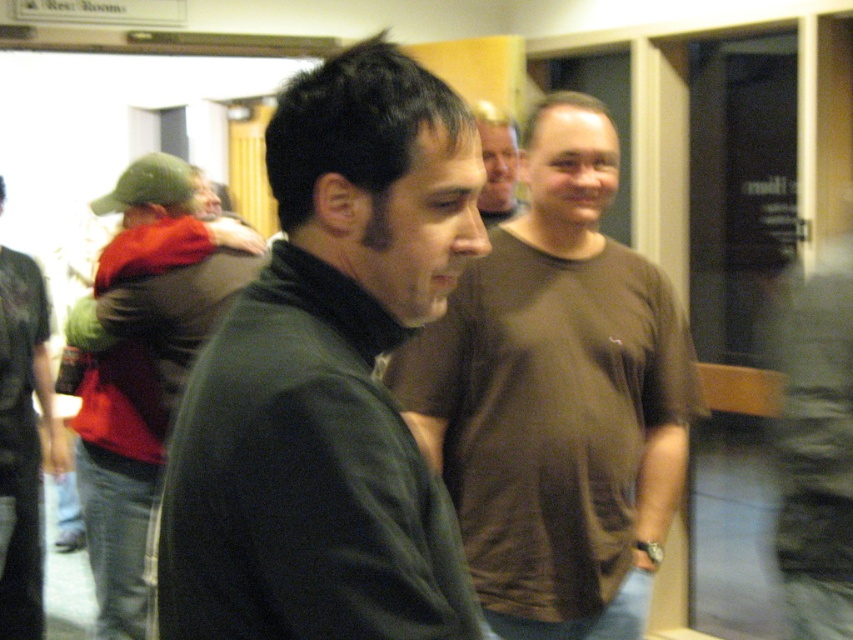
Question: Is brown cotton shirt at center positioned at the back of dark gray sweater at left?

Choices:
 (A) yes
 (B) no

Answer: (B)

Question: Does dark green sweater at center have a larger size compared to brown cotton shirt at center?

Choices:
 (A) no
 (B) yes

Answer: (A)

Question: Which object is the farthest from the dark gray sweater at left?

Choices:
 (A) dark green sweater at center
 (B) green fabric cap at left

Answer: (A)

Question: Among these points, which one is farthest from the camera?

Choices:
 (A) [415, 125]
 (B) [207, 276]

Answer: (B)

Question: Can you confirm if green fabric cap at left is positioned below brown cotton t-shirt at center?

Choices:
 (A) yes
 (B) no

Answer: (A)

Question: Which is nearer to the dark gray sweater at left?

Choices:
 (A) dark green sweater at center
 (B) brown cotton t-shirt at center

Answer: (B)